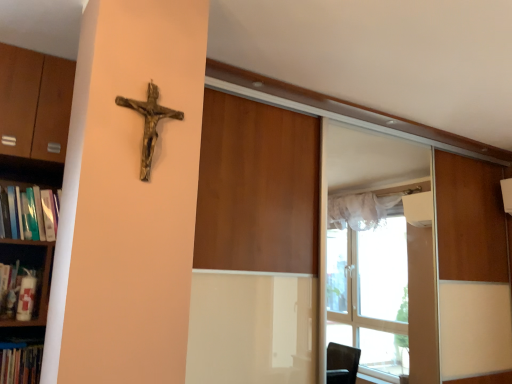
Question: Does white matte shelf at left, the second shelf viewed from the top, have a greater width compared to wooden bookshelf at left, acting as the 1th shelf starting from the top?

Choices:
 (A) yes
 (B) no

Answer: (B)

Question: Considering the relative sizes of white matte shelf at left, the second shelf viewed from the top, and wooden bookshelf at left, acting as the 1th shelf starting from the top, in the image provided, is white matte shelf at left, the second shelf viewed from the top, thinner than wooden bookshelf at left, acting as the 1th shelf starting from the top,?

Choices:
 (A) no
 (B) yes

Answer: (B)

Question: From the image's perspective, does white matte shelf at left, which appears as the 1th shelf when ordered from the bottom, appear higher than wooden bookshelf at left, acting as the 1th shelf starting from the top?

Choices:
 (A) yes
 (B) no

Answer: (B)

Question: Can you confirm if white matte shelf at left, which appears as the 1th shelf when ordered from the bottom, is positioned to the left of wooden bookshelf at left, which is counted as the 2th shelf, starting from the bottom?

Choices:
 (A) yes
 (B) no

Answer: (A)

Question: Is white matte shelf at left, which appears as the 1th shelf when ordered from the bottom, positioned behind wooden bookshelf at left, acting as the 1th shelf starting from the top?

Choices:
 (A) yes
 (B) no

Answer: (A)

Question: Would you say white matte shelf at left, which appears as the 1th shelf when ordered from the bottom, is a long distance from wooden bookshelf at left, which is counted as the 2th shelf, starting from the bottom?

Choices:
 (A) yes
 (B) no

Answer: (B)

Question: Is hardcover book at left outside white matte shelf at left, the second shelf viewed from the top?

Choices:
 (A) no
 (B) yes

Answer: (B)

Question: Are hardcover book at left and white matte shelf at left, which appears as the 1th shelf when ordered from the bottom, far apart?

Choices:
 (A) yes
 (B) no

Answer: (B)

Question: Is hardcover book at left further to the viewer compared to white matte shelf at left, the second shelf viewed from the top?

Choices:
 (A) yes
 (B) no

Answer: (B)

Question: Can you confirm if hardcover book at left is bigger than white matte shelf at left, which appears as the 1th shelf when ordered from the bottom?

Choices:
 (A) no
 (B) yes

Answer: (A)

Question: Does hardcover book at left appear on the left side of white matte shelf at left, the second shelf viewed from the top?

Choices:
 (A) no
 (B) yes

Answer: (A)

Question: Does hardcover book at left have a lesser height compared to white matte shelf at left, which appears as the 1th shelf when ordered from the bottom?

Choices:
 (A) yes
 (B) no

Answer: (A)

Question: From the image's perspective, is wooden crucifix at upper left on top of hardcover book at left?

Choices:
 (A) yes
 (B) no

Answer: (A)